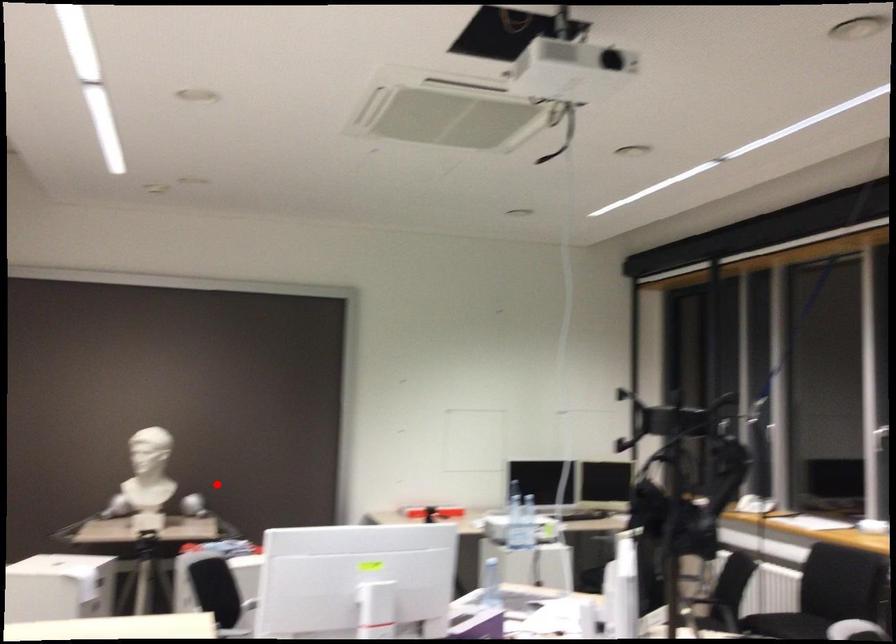
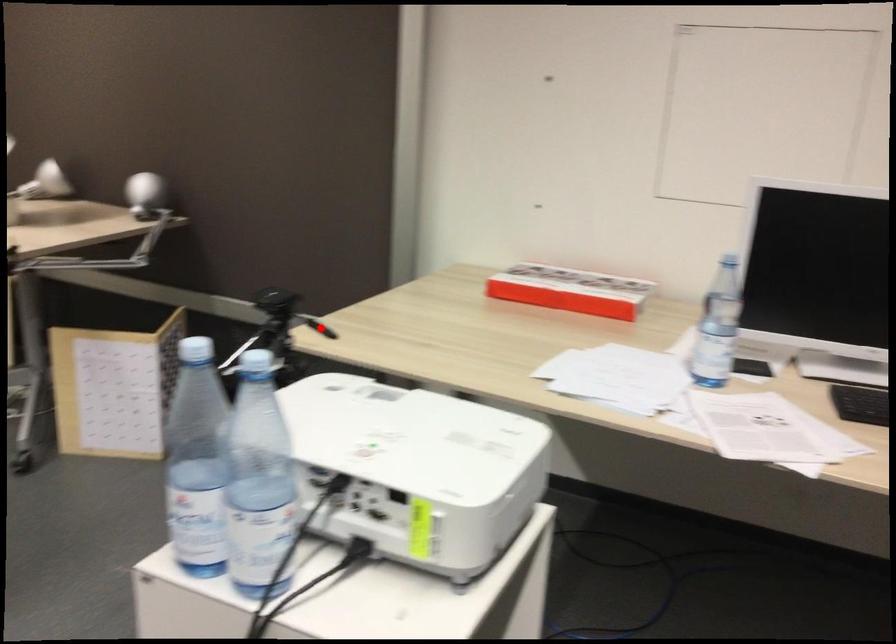
I am providing you with two images of the same scene from different viewpoints. A red point is marked on the first image and another point is marked on the second image. Does the point marked in image1 correspond to the same location as the one in image2?

No